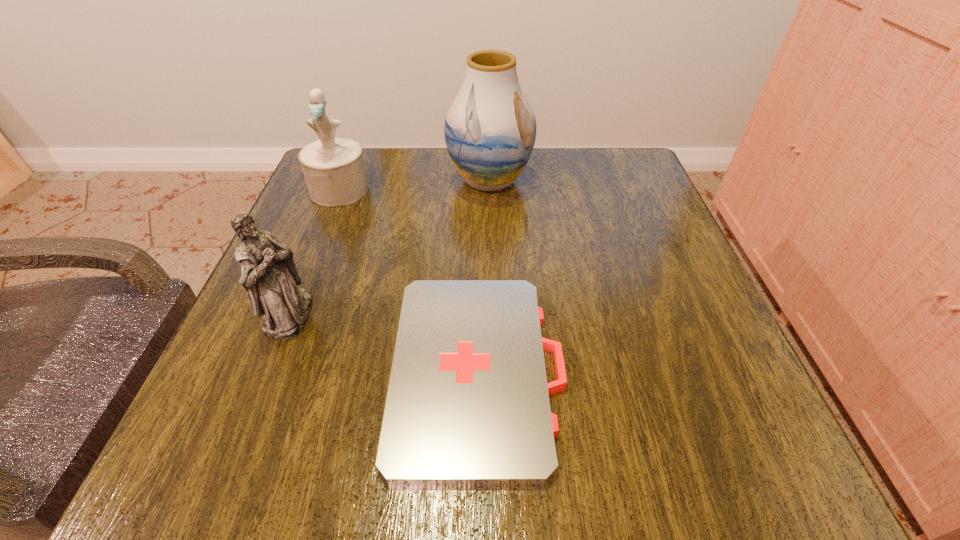
Locate an element on the screen. free space between the nearer figurine and the vase is located at coordinates (389, 248).

Locate an element on the screen. free spot between the first-aid kit and the vase is located at coordinates (484, 275).

Where is `free space between the shortest object and the nearer figurine`? This screenshot has width=960, height=540. free space between the shortest object and the nearer figurine is located at coordinates (384, 342).

At what (x,y) coordinates should I click in order to perform the action: click on unoccupied position between the vase and the farther figurine. Please return your answer as a coordinate pair (x, y). Looking at the image, I should click on point(415,185).

Image resolution: width=960 pixels, height=540 pixels. Find the location of `unoccupied area between the tallest object and the farther figurine`. unoccupied area between the tallest object and the farther figurine is located at coordinates (415, 185).

This screenshot has width=960, height=540. What are the coordinates of `free spot between the tallest object and the nearer figurine` in the screenshot? It's located at (389, 248).

The height and width of the screenshot is (540, 960). I want to click on free space between the nearer figurine and the shortest object, so click(384, 342).

Locate an element on the screen. object that is the closest to the farther figurine is located at coordinates (490, 129).

Locate an element on the screen. The height and width of the screenshot is (540, 960). object that is the second closest to the tallest object is located at coordinates (468, 403).

The width and height of the screenshot is (960, 540). In order to click on free space in the image that satisfies the following two spatial constraints: 1. at the beak of the farther figurine; 2. on the front-facing side of the nearer figurine in this screenshot , I will do `click(290, 315)`.